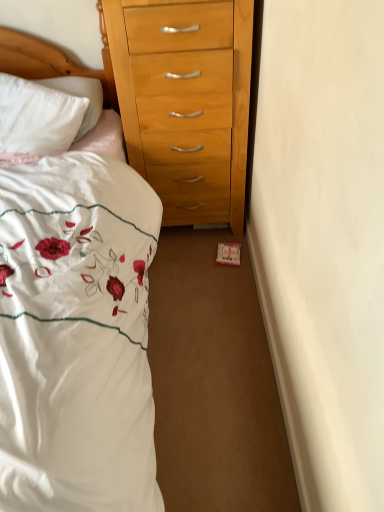
This screenshot has height=512, width=384. Describe the element at coordinates (76, 336) in the screenshot. I see `white embroidered fabric at left` at that location.

In order to click on white embroidered fabric at left in this screenshot , I will do `click(76, 336)`.

The width and height of the screenshot is (384, 512). What are the coordinates of `wooden headboard at upper left` in the screenshot? It's located at (64, 76).

Image resolution: width=384 pixels, height=512 pixels. What do you see at coordinates (64, 76) in the screenshot?
I see `wooden headboard at upper left` at bounding box center [64, 76].

Image resolution: width=384 pixels, height=512 pixels. What are the coordinates of `white embroidered fabric at left` in the screenshot? It's located at (76, 336).

Considering the relative positions of wooden headboard at upper left and white embroidered fabric at left in the image provided, is wooden headboard at upper left to the left or to the right of white embroidered fabric at left?

Clearly, wooden headboard at upper left is on the left of white embroidered fabric at left in the image.

In the scene shown: Which object is closer to the camera, wooden headboard at upper left or white embroidered fabric at left?

white embroidered fabric at left.

Between point (122, 149) and point (144, 337), which one is positioned in front?

Point (144, 337)

From the image's perspective, which object appears higher, wooden headboard at upper left or white embroidered fabric at left?

wooden headboard at upper left, from the image's perspective.

From a real-world perspective, who is located higher, wooden headboard at upper left or white embroidered fabric at left?

From a 3D spatial view, wooden headboard at upper left is above.

Between wooden headboard at upper left and white embroidered fabric at left, which one has larger width?

white embroidered fabric at left.

Who is taller, wooden headboard at upper left or white embroidered fabric at left?

white embroidered fabric at left is taller.

Which of these two, wooden headboard at upper left or white embroidered fabric at left, is smaller?

With smaller size is wooden headboard at upper left.

Is wooden headboard at upper left not inside white embroidered fabric at left?

Actually, wooden headboard at upper left is within white embroidered fabric at left.

Looking at this image, is wooden headboard at upper left in contact with white embroidered fabric at left?

No, wooden headboard at upper left is not making contact with white embroidered fabric at left.

Could you tell me if wooden headboard at upper left is turned towards white embroidered fabric at left?

Yes, wooden headboard at upper left is aimed at white embroidered fabric at left.

How many degrees apart are the facing directions of wooden headboard at upper left and white embroidered fabric at left?

The angle between the facing direction of wooden headboard at upper left and the facing direction of white embroidered fabric at left is 21.5 degrees.

I want to click on bed below the wooden headboard at upper left (from the image's perspective), so click(x=76, y=336).

Based on the photo, which is more to the right, white embroidered fabric at left or wooden headboard at upper left?

From the viewer's perspective, white embroidered fabric at left appears more on the right side.

Is white embroidered fabric at left in front of or behind wooden headboard at upper left in the image?

white embroidered fabric at left is in front of wooden headboard at upper left.

Which point is more distant from viewer, (29, 189) or (115, 154)?

Positioned behind is point (115, 154).

Looking at this image, from the image's perspective, relative to wooden headboard at upper left, is white embroidered fabric at left above or below?

white embroidered fabric at left is situated lower than wooden headboard at upper left in the image.

From a real-world perspective, is white embroidered fabric at left located beneath wooden headboard at upper left?

Correct, in the physical world, white embroidered fabric at left is lower than wooden headboard at upper left.

In terms of width, does white embroidered fabric at left look wider or thinner when compared to wooden headboard at upper left?

Considering their sizes, white embroidered fabric at left looks broader than wooden headboard at upper left.

Considering the sizes of objects white embroidered fabric at left and wooden headboard at upper left in the image provided, who is shorter, white embroidered fabric at left or wooden headboard at upper left?

Standing shorter between the two is wooden headboard at upper left.

Based on their sizes in the image, would you say white embroidered fabric at left is bigger or smaller than wooden headboard at upper left?

white embroidered fabric at left is bigger than wooden headboard at upper left.

Is wooden headboard at upper left located within white embroidered fabric at left?

Yes, white embroidered fabric at left contains wooden headboard at upper left.

Is the surface of white embroidered fabric at left in direct contact with wooden headboard at upper left?

No, white embroidered fabric at left is not making contact with wooden headboard at upper left.

Is white embroidered fabric at left turned away from wooden headboard at upper left?

Absolutely, white embroidered fabric at left is directed away from wooden headboard at upper left.

How different are the orientations of white embroidered fabric at left and wooden headboard at upper left in degrees?

21.5 degrees.

Locate an element on the screen. headboard that appears above the white embroidered fabric at left (from the image's perspective) is located at coordinates (64, 76).

The height and width of the screenshot is (512, 384). Find the location of `headboard to the left of white embroidered fabric at left`. headboard to the left of white embroidered fabric at left is located at coordinates (64, 76).

Locate an element on the screen. This screenshot has width=384, height=512. bed on the right side of wooden headboard at upper left is located at coordinates (76, 336).